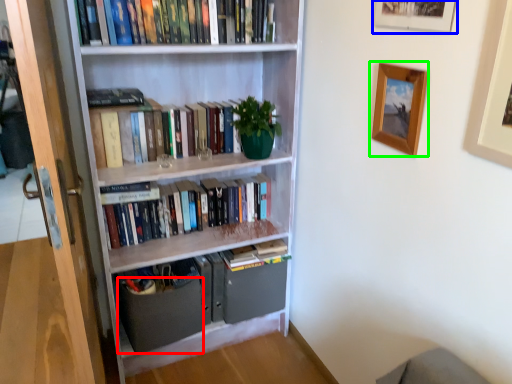
Question: Which object is the closest to the drawer (highlighted by a red box)? Choose among these: picture frame (highlighted by a blue box) or picture frame (highlighted by a green box).

Choices:
 (A) picture frame
 (B) picture frame

Answer: (B)